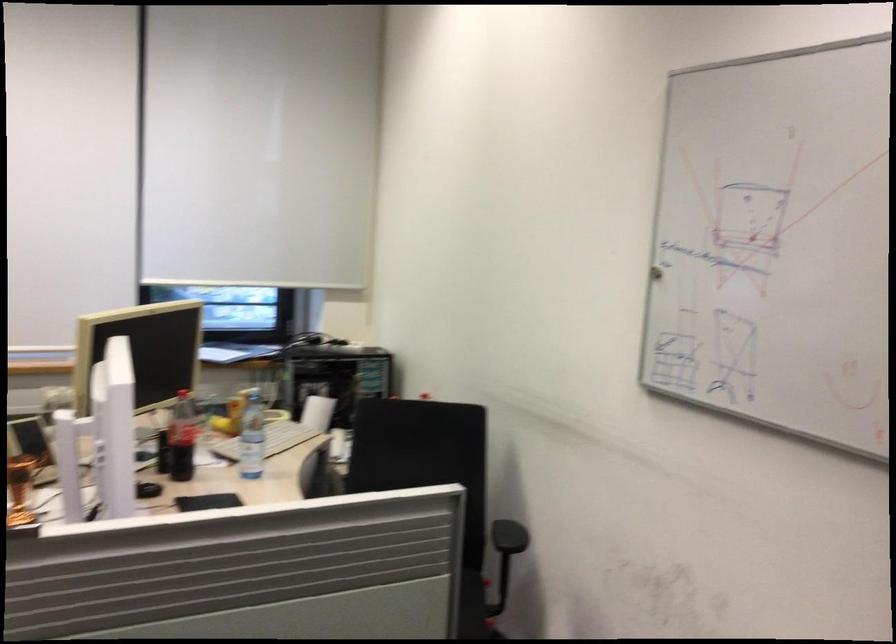
Describe the element at coordinates (509, 536) in the screenshot. I see `a chair armrest` at that location.